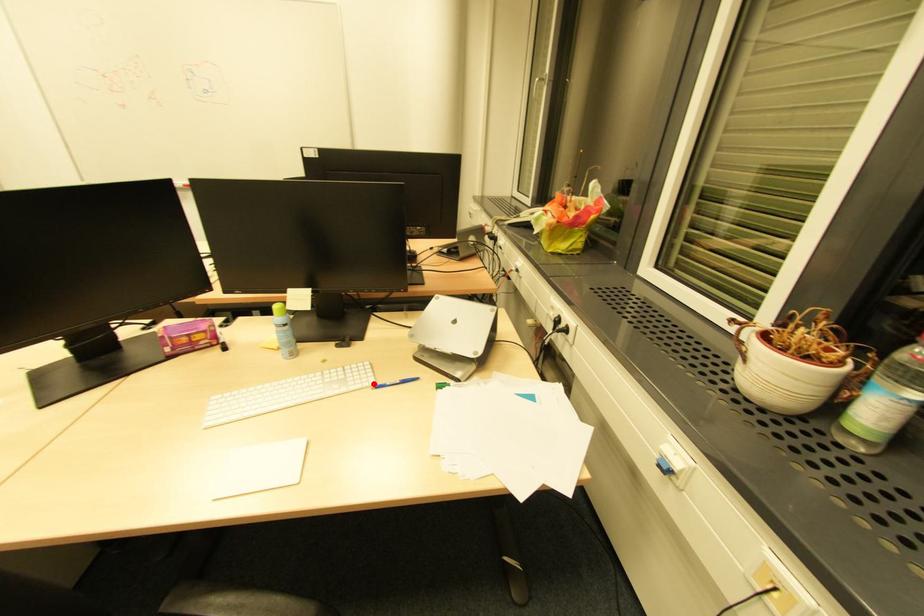
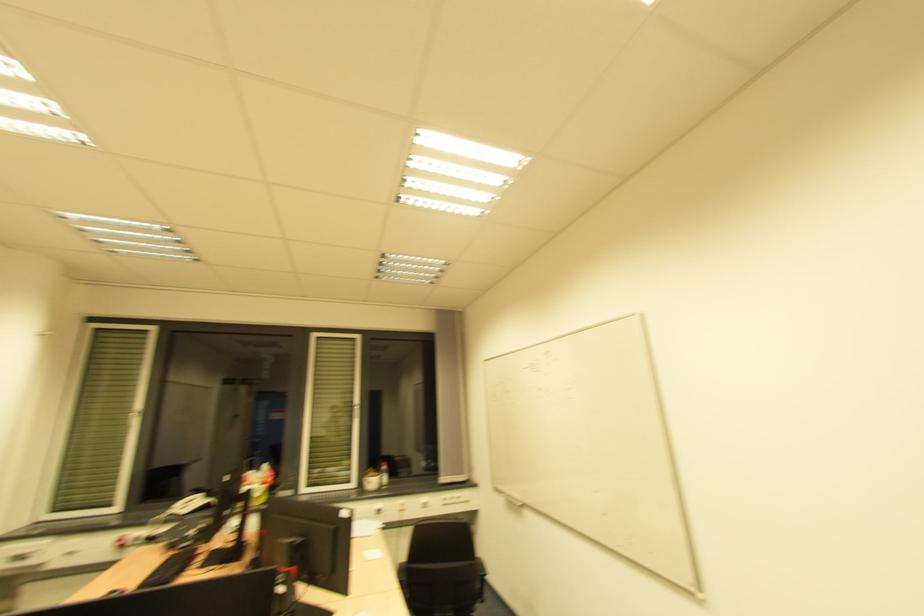
Question: I am providing you with two images of the same scene from different viewpoints. A red point is marked on the first image. Can you still see the location of the red point in image 2?

Choices:
 (A) Yes
 (B) No

Answer: (B)